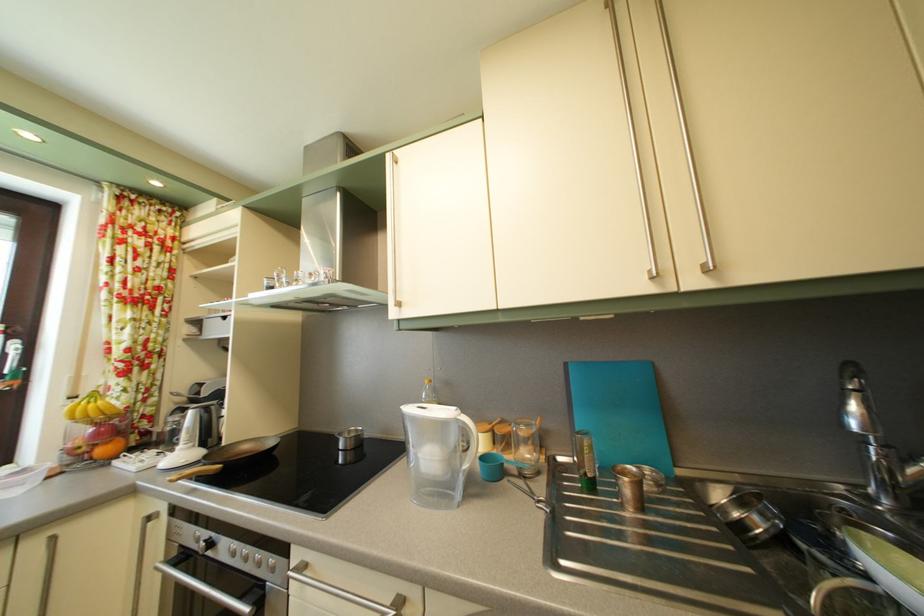
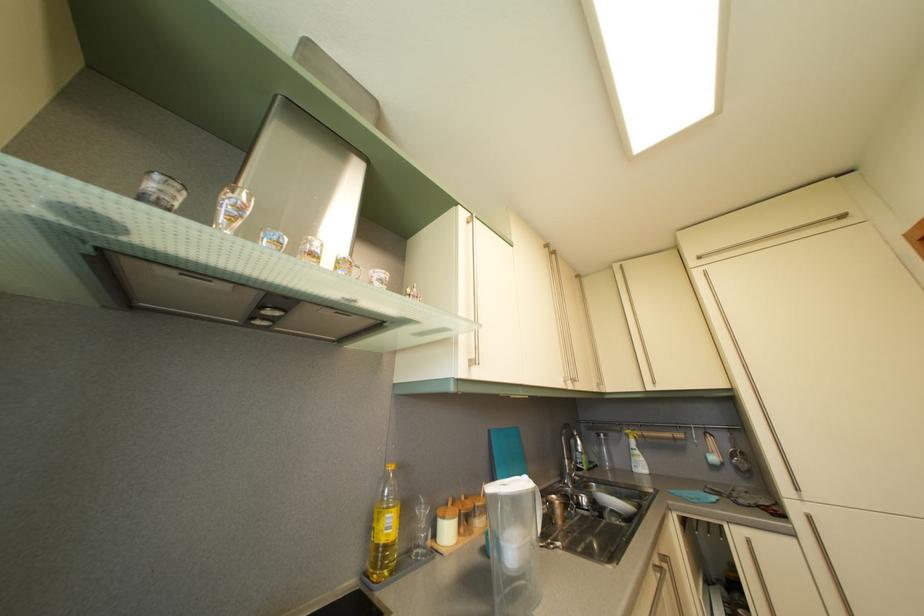
Find the pixel in the second image that matches pixel 574 371 in the first image.

(497, 439)